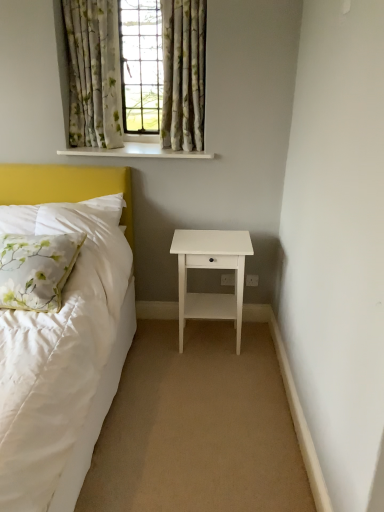
Image resolution: width=384 pixels, height=512 pixels. Identify the location of free spot in front of white glossy nightstand at lower right. (209, 380).